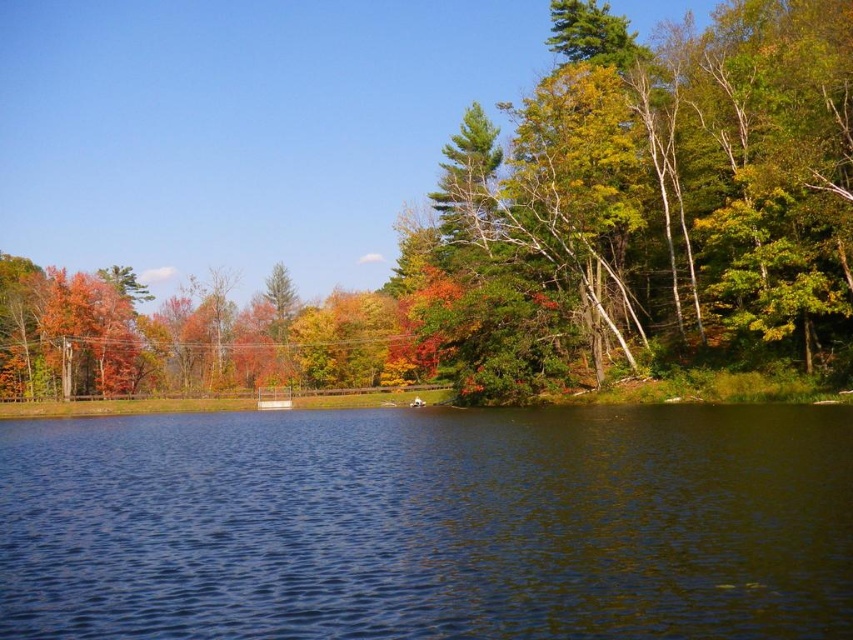
Question: Can you confirm if autumn leaves at center is positioned to the left of dark blue water at center?

Choices:
 (A) no
 (B) yes

Answer: (B)

Question: Is autumn leaves at center above dark blue water at center?

Choices:
 (A) no
 (B) yes

Answer: (B)

Question: Which of the following is the closest to the observer?

Choices:
 (A) (579, 577)
 (B) (393, 61)

Answer: (A)

Question: Which point is closer to the camera?

Choices:
 (A) autumn leaves at center
 (B) dark blue water at center

Answer: (B)

Question: Can you confirm if autumn leaves at center is smaller than dark blue water at center?

Choices:
 (A) no
 (B) yes

Answer: (A)

Question: Which of the following is the closest to the observer?

Choices:
 (A) autumn leaves at center
 (B) dark blue water at center

Answer: (B)